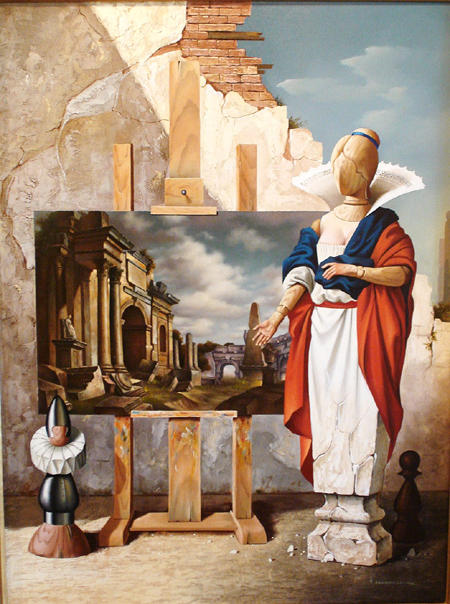
The width and height of the screenshot is (450, 604). I want to click on bottom edge of painting, so 187,406.